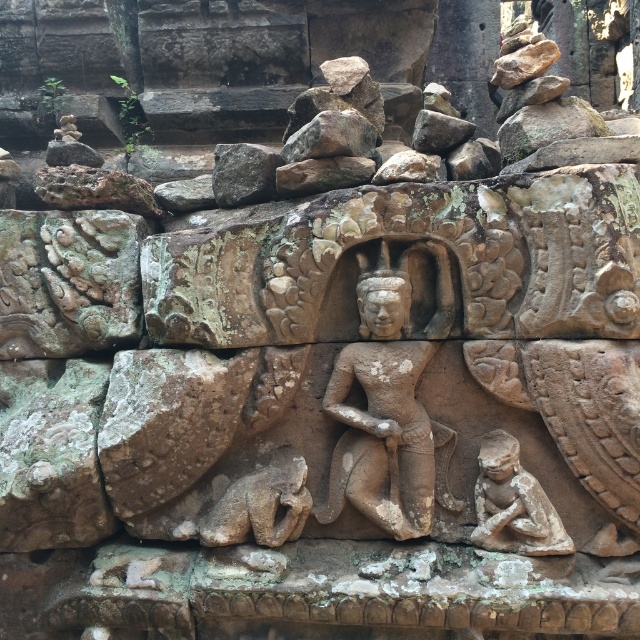
You are an archaeologist examining the stone relief. You notice the stone statue at center and the brown stone cat at lower center. Which object is taller?

The stone statue at center is taller than the brown stone cat at lower center.

Based on the photo, you are standing in front of an ancient stone relief in a temple. You want to take a photo of the stone statue at center with your camera. The recommended distance for clear photos is 5 feet. Is the current distance sufficient?

The stone statue at center and camera are 5.41 feet apart, which is slightly more than the recommended 5 feet. However, this distance should still allow for a clear photo as long as the camera is focused properly.